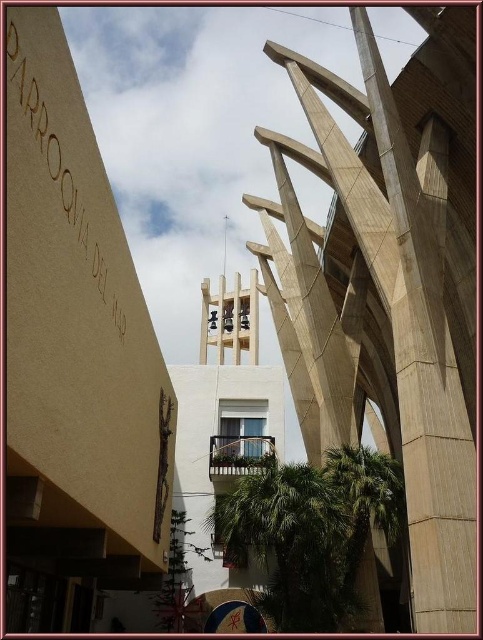
Question: Can you confirm if beige stone structure at center is smaller than gold cardboard sign at upper left?

Choices:
 (A) yes
 (B) no

Answer: (B)

Question: Which of the following is the farthest from the observer?

Choices:
 (A) gold cardboard sign at upper left
 (B) green leafy palm tree at center
 (C) green leafy palm tree at lower center
 (D) beige stone structure at center

Answer: (C)

Question: Considering the real-world distances, which object is farthest from the green leafy palm tree at lower center?

Choices:
 (A) beige stone structure at center
 (B) green leafy palm tree at center
 (C) gold cardboard sign at upper left

Answer: (C)

Question: Based on their relative distances, which object is nearer to the green leafy palm tree at center?

Choices:
 (A) green leafy palm tree at lower center
 (B) beige stone structure at center

Answer: (A)

Question: Where is beige stone structure at center located in relation to green leafy palm tree at lower center in the image?

Choices:
 (A) left
 (B) right

Answer: (B)

Question: Is beige stone structure at center positioned behind green leafy palm tree at center?

Choices:
 (A) yes
 (B) no

Answer: (B)